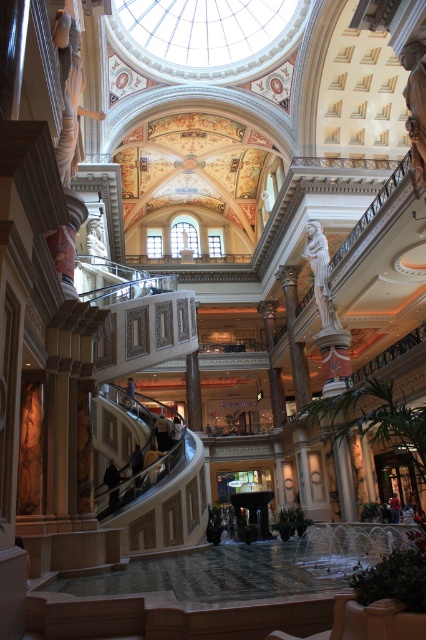
Between point (69, 108) and point (322, 289), which one is positioned behind?

The point (322, 289) is behind.

I want to click on white marble statue at upper left, so tap(69, 96).

Which is above, white marble statue at upper left or polished bronze statue at upper right?

Positioned higher is white marble statue at upper left.

Measure the distance between white marble statue at upper left and camera.

They are 37.63 meters apart.

Find the location of a particular element. The image size is (426, 640). white marble statue at upper left is located at coordinates (69, 96).

Does point (409, 115) come in front of point (327, 262)?

That is True.

This screenshot has height=640, width=426. What do you see at coordinates (416, 99) in the screenshot?
I see `polished bronze statue at upper right` at bounding box center [416, 99].

Which is behind, point (400, 52) or point (314, 292)?

Positioned behind is point (314, 292).

I want to click on polished bronze statue at upper right, so click(416, 99).